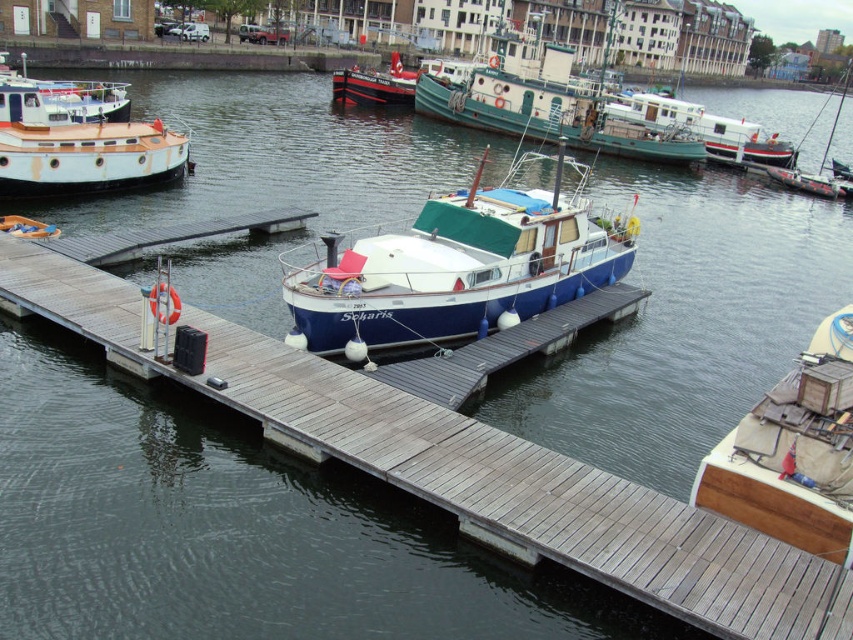
You are planning to dock your 3.5 meter wide boat. You see the wooden deck at center and the white matte houseboat at right. Which one has enough space for your boat?

The white matte houseboat at right has a greater width than the wooden deck at center, so it can accommodate your 3.5 meter wide boat.

You are a dock worker who needs to move a 30 meter long cargo barge through the marina. The barge requires a minimum of 3 meters of clearance on all sides to navigate safely. Based on the scene, is there enough space between the blue matte boat at center and the black matte sailboat at upper right to allow the barge to pass through?

The distance between the blue matte boat at center and the black matte sailboat at upper right is 32.53 meters. Subtracting the required 3 meters of clearance on both sides, the available space is 32.53 minus 6 equals 26.53 meters. Since the cargo barge is 30 meters long, it would require at least 30 meters of space to pass. Therefore, the available space of 26.53 meters is insufficient for the barge to navigate safely between them.